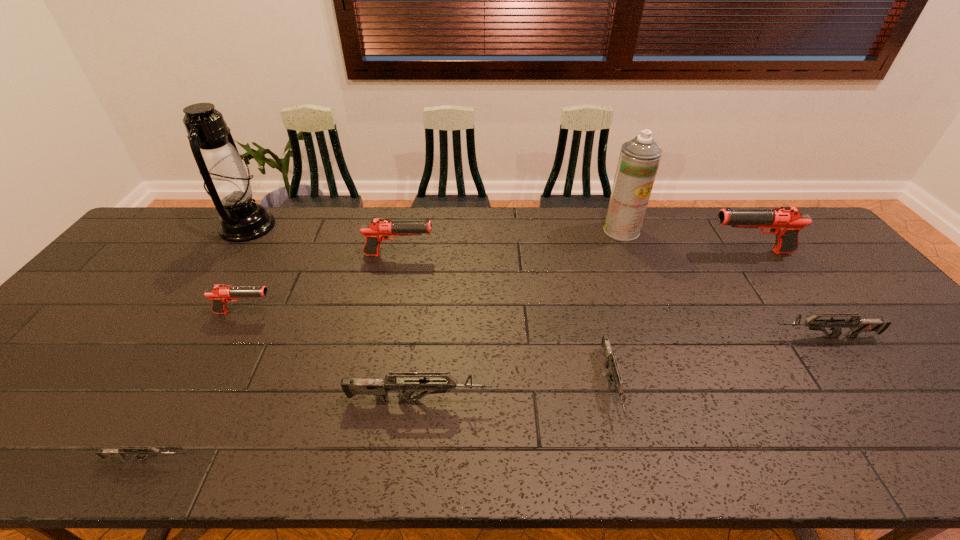
This screenshot has width=960, height=540. I want to click on aerosol can at the far edge, so click(639, 159).

Image resolution: width=960 pixels, height=540 pixels. Find the location of `gun that is at the far edge`. gun that is at the far edge is located at coordinates (785, 222).

I want to click on object positioned at the far right corner, so click(785, 222).

The height and width of the screenshot is (540, 960). Find the location of `vacant region at the far edge of the desktop`. vacant region at the far edge of the desktop is located at coordinates (503, 230).

I want to click on vacant region at the near edge of the desktop, so click(641, 432).

You are a GUI agent. You are given a task and a screenshot of the screen. Output one action in this format:
    pyautogui.click(x=<x>, y=<y>)
    Task: Click on the blank space at the left edge of the desktop
    This screenshot has width=960, height=540.
    Given the screenshot: What is the action you would take?
    pyautogui.click(x=132, y=308)

Where is `vacant space at the right edge`? The image size is (960, 540). vacant space at the right edge is located at coordinates (905, 405).

What are the coordinates of `vacant space at the far left corner of the desktop` in the screenshot? It's located at tap(206, 220).

This screenshot has width=960, height=540. I want to click on free spot between the sixth shortest object and the biggest grey gun, so click(x=409, y=327).

Identify the location of free space between the second biggest grey gun and the eighth shortest object. (723, 284).